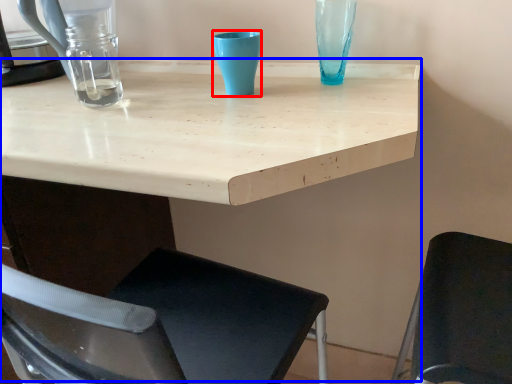
Question: Which object appears farthest to the camera in this image, turquoise (highlighted by a red box) or table (highlighted by a blue box)?

Choices:
 (A) turquoise
 (B) table

Answer: (A)